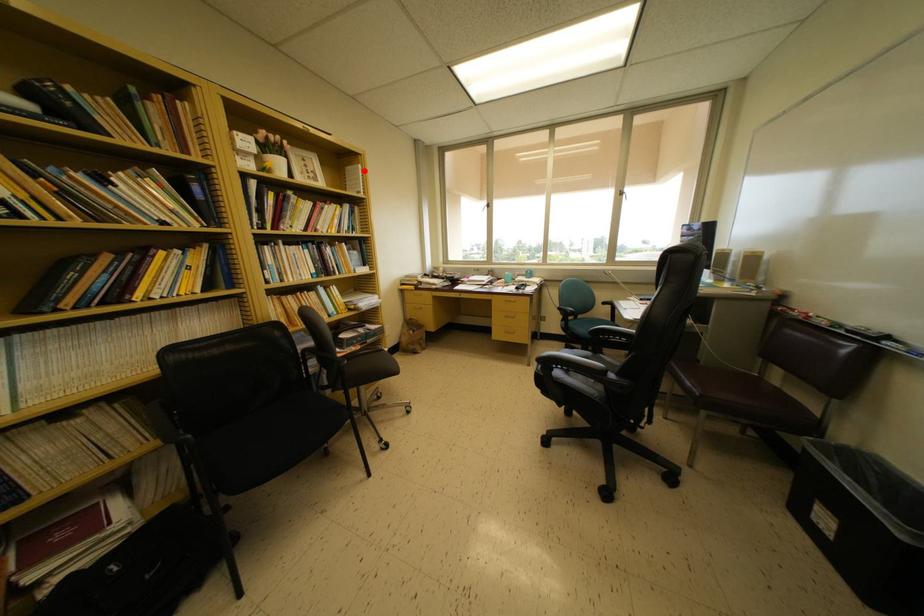
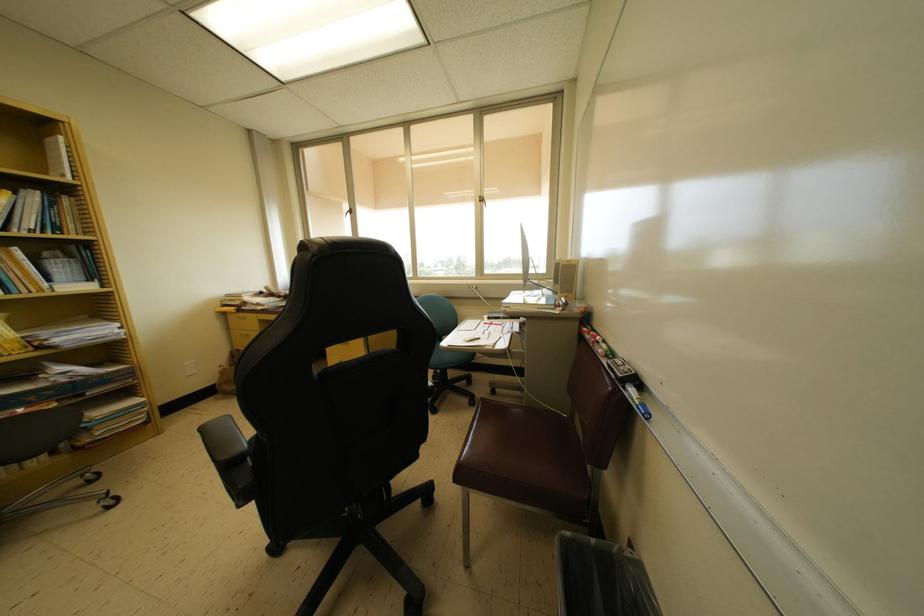
Question: A red point is marked in image1. In image2, is the corresponding 3D point closer to the camera or farther? Reply with the corresponding letter.

Choices:
 (A) The corresponding 3D point is closer.
 (B) The corresponding 3D point is farther.

Answer: (B)